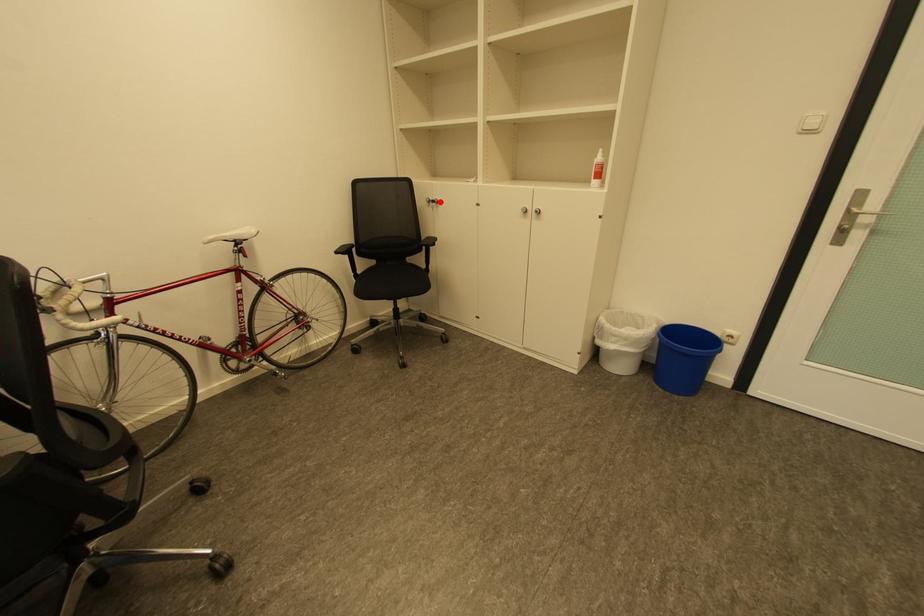
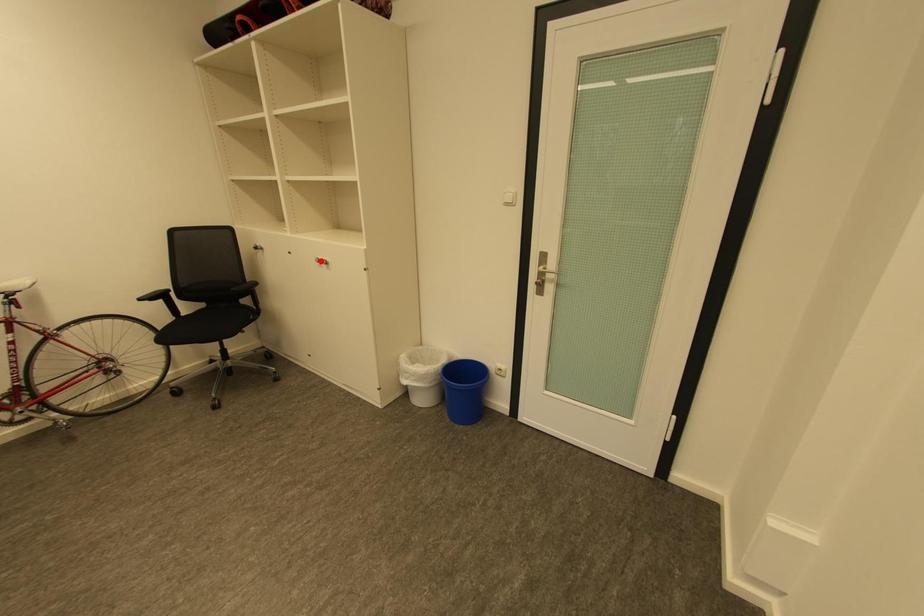
I am providing you with two images of the same scene from different viewpoints. A red point is marked on the first image and another point is marked on the second image. Does the point marked in image1 correspond to the same location as the one in image2?

No